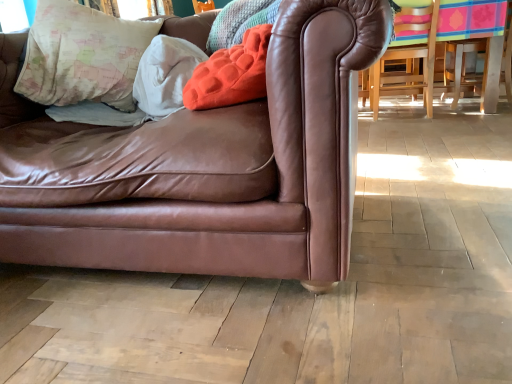
Question: Should I look upward or downward to see map-patterned fabric pillow at upper left, the third pillow positioned from the right?

Choices:
 (A) down
 (B) up

Answer: (B)

Question: In which direction should I rotate to look at velvety orange pillow at upper center, marked as the first pillow in a right-to-left arrangement?

Choices:
 (A) left
 (B) right

Answer: (A)

Question: Does map-patterned fabric pillow at upper left, the third pillow positioned from the right, have a greater width compared to velvety orange pillow at upper center, marked as the first pillow in a right-to-left arrangement?

Choices:
 (A) no
 (B) yes

Answer: (B)

Question: Is map-patterned fabric pillow at upper left, which ranks as the first pillow in left-to-right order, behind velvety orange pillow at upper center, which appears as the 3th pillow when viewed from the left?

Choices:
 (A) no
 (B) yes

Answer: (B)

Question: From a real-world perspective, is map-patterned fabric pillow at upper left, which ranks as the first pillow in left-to-right order, on top of velvety orange pillow at upper center, marked as the first pillow in a right-to-left arrangement?

Choices:
 (A) no
 (B) yes

Answer: (B)

Question: From the image's perspective, is map-patterned fabric pillow at upper left, the third pillow positioned from the right, under velvety orange pillow at upper center, which appears as the 3th pillow when viewed from the left?

Choices:
 (A) yes
 (B) no

Answer: (B)

Question: Does map-patterned fabric pillow at upper left, the third pillow positioned from the right, appear on the left side of velvety orange pillow at upper center, marked as the first pillow in a right-to-left arrangement?

Choices:
 (A) yes
 (B) no

Answer: (A)

Question: Is map-patterned fabric pillow at upper left, the third pillow positioned from the right, shorter than velvety orange pillow at upper center, which appears as the 3th pillow when viewed from the left?

Choices:
 (A) no
 (B) yes

Answer: (A)

Question: From a real-world perspective, is map-patterned fabric pillow at upper left, which ranks as the first pillow in left-to-right order, physically below brown leather couch at center?

Choices:
 (A) no
 (B) yes

Answer: (A)

Question: Could you tell me if map-patterned fabric pillow at upper left, the third pillow positioned from the right, is facing brown leather couch at center?

Choices:
 (A) no
 (B) yes

Answer: (B)

Question: From a real-world perspective, is map-patterned fabric pillow at upper left, which ranks as the first pillow in left-to-right order, positioned over brown leather couch at center based on gravity?

Choices:
 (A) no
 (B) yes

Answer: (B)

Question: Would you say map-patterned fabric pillow at upper left, the third pillow positioned from the right, is outside brown leather couch at center?

Choices:
 (A) no
 (B) yes

Answer: (A)

Question: Can you confirm if map-patterned fabric pillow at upper left, which ranks as the first pillow in left-to-right order, is thinner than brown leather couch at center?

Choices:
 (A) yes
 (B) no

Answer: (A)

Question: From the image's perspective, is map-patterned fabric pillow at upper left, which ranks as the first pillow in left-to-right order, on brown leather couch at center?

Choices:
 (A) no
 (B) yes

Answer: (B)

Question: Can you confirm if white soft pillow at upper left, the second pillow positioned from the right, is taller than velvety orange pillow at upper center, which appears as the 3th pillow when viewed from the left?

Choices:
 (A) no
 (B) yes

Answer: (B)